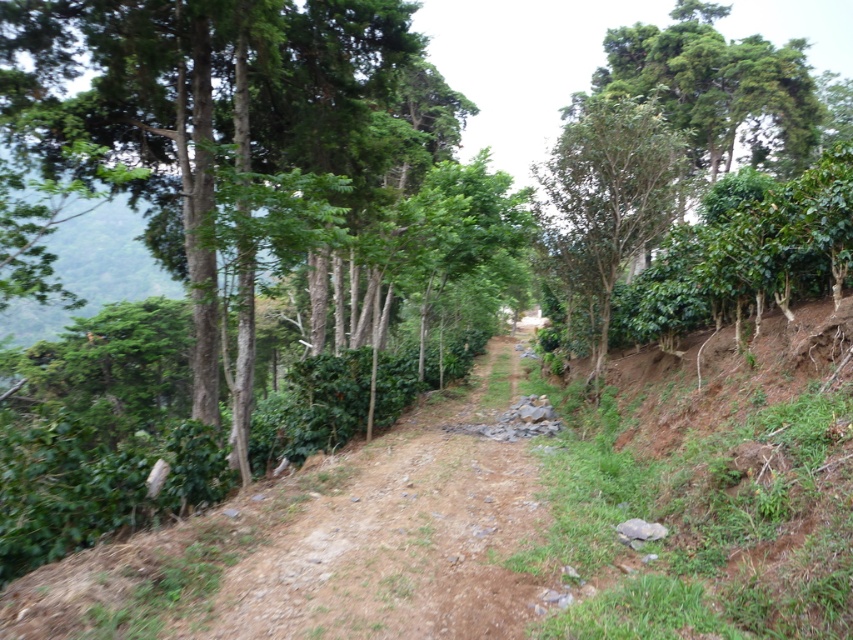
Is green leafy tree at center wider than green leafy tree at upper right?

Correct, the width of green leafy tree at center exceeds that of green leafy tree at upper right.

Which is in front, point (293, 54) or point (608, 282)?

Positioned in front is point (293, 54).

Is point (357, 125) closer to camera compared to point (607, 186)?

That is False.

Find the location of `green leafy tree at center`. green leafy tree at center is located at coordinates (233, 129).

Does dirt path at center have a lesser width compared to green leafy tree at upper right?

Yes.

Who is more distant from viewer, [379,620] or [616,125]?

Point [616,125]

You are a GUI agent. You are given a task and a screenshot of the screen. Output one action in this format:
    pyautogui.click(x=<x>, y=<y>)
    Task: Click on the dirt path at center
    
    Given the screenshot: What is the action you would take?
    pyautogui.click(x=397, y=531)

Who is more distant from viewer, (247,268) or (219,604)?

Positioned behind is point (247,268).

Is green leafy tree at center thinner than dirt path at center?

In fact, green leafy tree at center might be wider than dirt path at center.

The height and width of the screenshot is (640, 853). Find the location of `green leafy tree at center`. green leafy tree at center is located at coordinates (233, 129).